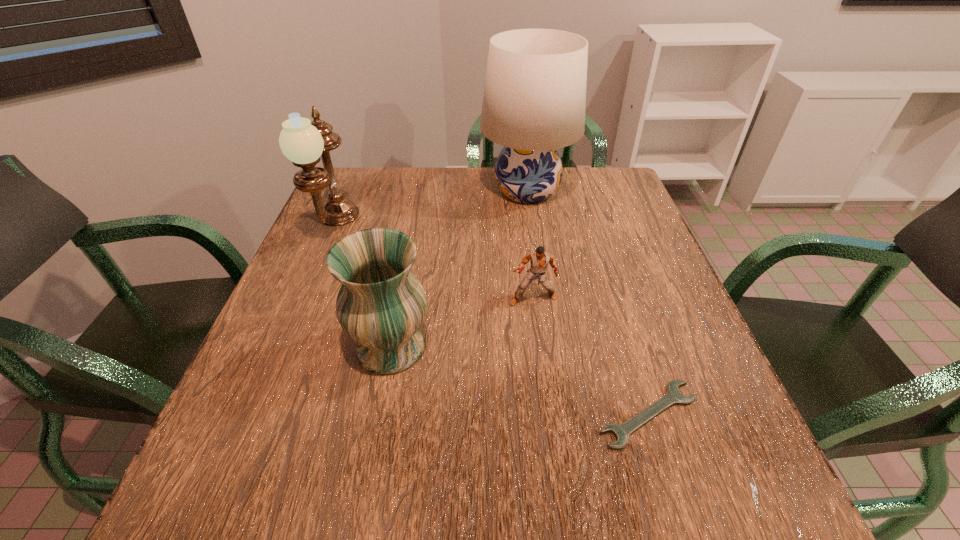
At what (x,y) coordinates should I click in order to perform the action: click on vacant space located on the front-facing side of the tallest object. Please return your answer as a coordinate pair (x, y). The width and height of the screenshot is (960, 540). Looking at the image, I should click on (460, 191).

Image resolution: width=960 pixels, height=540 pixels. I want to click on blank space located on the front-facing side of the tallest object, so click(362, 191).

This screenshot has height=540, width=960. What are the coordinates of `vacant space located on the right of the fourth shortest object` in the screenshot? It's located at (398, 227).

I want to click on free space located 0.220m on the back of the third tallest object, so click(409, 254).

Identify the location of free space located on the front-facing side of the third farthest object. The image size is (960, 540). (541, 368).

This screenshot has width=960, height=540. I want to click on free spot located 0.080m on the front of the wrench, so click(676, 501).

At what (x,y) coordinates should I click in order to perform the action: click on lampshade at the far edge. Please return your answer as a coordinate pair (x, y). This screenshot has width=960, height=540. Looking at the image, I should click on point(534,101).

Identify the location of oil lamp that is at the far edge. (303, 142).

Image resolution: width=960 pixels, height=540 pixels. Find the location of `object at the left edge`. object at the left edge is located at coordinates (303, 142).

Locate an element on the screen. This screenshot has width=960, height=540. object located in the right edge section of the desktop is located at coordinates (673, 396).